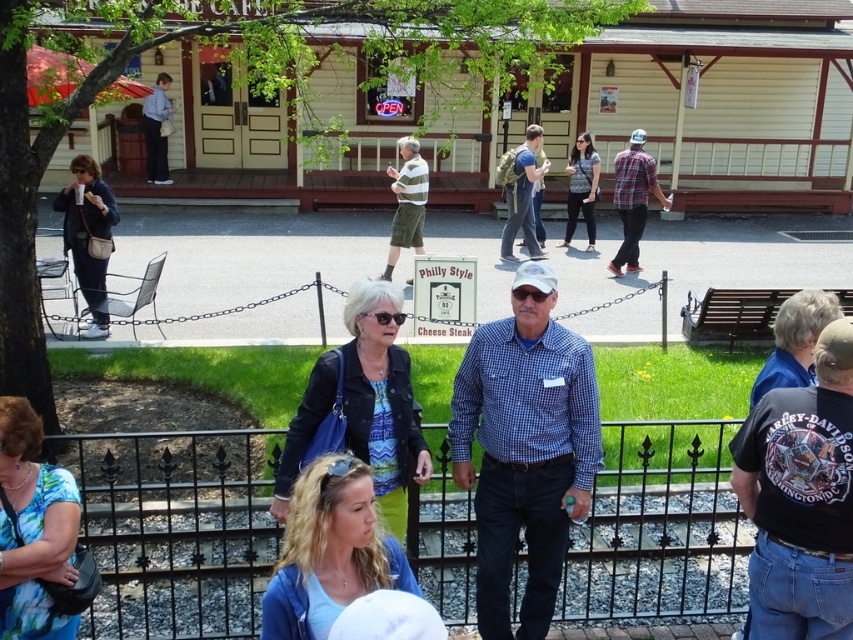
Question: Does dark blue jacket at left have a smaller size compared to blue denim jacket at lower right?

Choices:
 (A) yes
 (B) no

Answer: (B)

Question: Which object is positioned closest to the black leather jacket at center?

Choices:
 (A) dark blue jacket at left
 (B) striped cotton shirt at center

Answer: (A)

Question: Which is farther from the floral blouse at center?

Choices:
 (A) dark gray shirt at center
 (B) blonde hair at center
 (C) matte blue shirt at center
 (D) black leather jacket at center

Answer: (A)

Question: Can you confirm if matte blue shirt at center is thinner than light blue shirt at upper left?

Choices:
 (A) no
 (B) yes

Answer: (B)

Question: Is black cotton t-shirt at lower right above matte blue shirt at center?

Choices:
 (A) no
 (B) yes

Answer: (A)

Question: Among these objects, which one is nearest to the camera?

Choices:
 (A) dark blue jacket at left
 (B) matte blue shirt at center
 (C) blue denim jacket at lower right
 (D) black cotton t-shirt at lower right

Answer: (D)